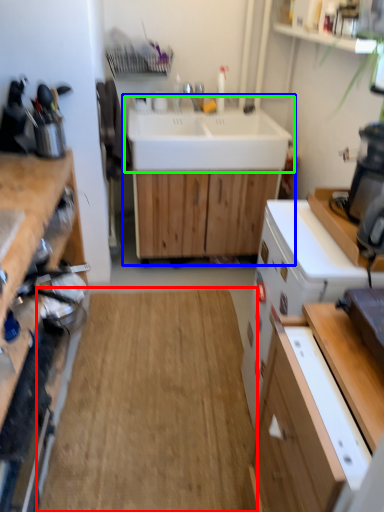
Question: Which object is the farthest from hardwood (highlighted by a red box)? Choose among these: sink (highlighted by a blue box) or sink (highlighted by a green box).

Choices:
 (A) sink
 (B) sink

Answer: (B)